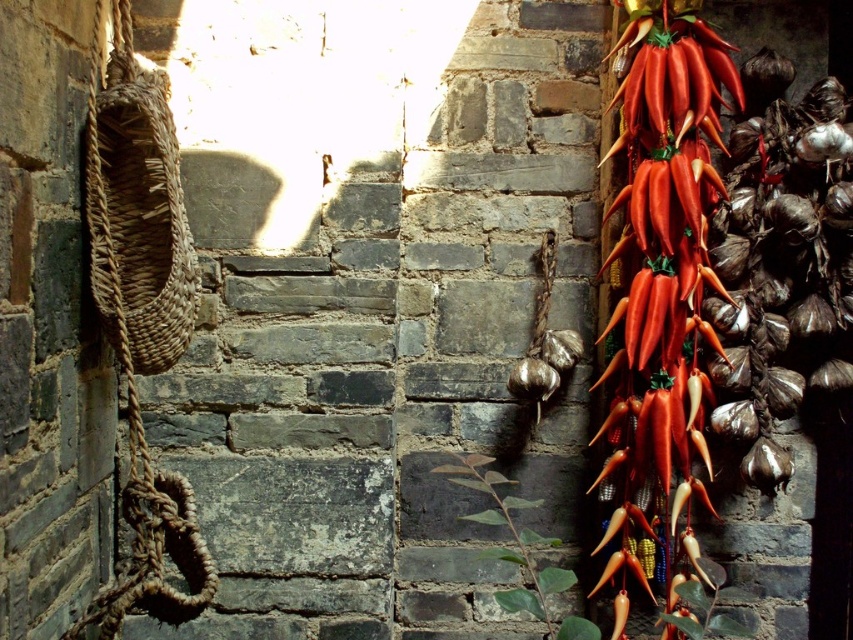
Question: Among these objects, which one is farthest from the camera?

Choices:
 (A) bright red chili peppers at center-right
 (B) green matte plant at center

Answer: (A)

Question: Which point appears farthest from the camera in this image?

Choices:
 (A) (517, 548)
 (B) (722, 284)

Answer: (A)

Question: Is bright red chili peppers at center-right to the right of green matte plant at center from the viewer's perspective?

Choices:
 (A) yes
 (B) no

Answer: (A)

Question: Does bright red chili peppers at center-right appear over green matte plant at center?

Choices:
 (A) yes
 (B) no

Answer: (A)

Question: Is bright red chili peppers at center-right below green matte plant at center?

Choices:
 (A) yes
 (B) no

Answer: (B)